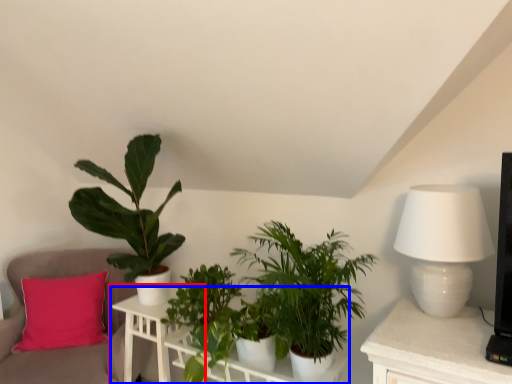
Question: Which point is further to the camera, table (highlighted by a red box) or table (highlighted by a blue box)?

Choices:
 (A) table
 (B) table

Answer: (A)